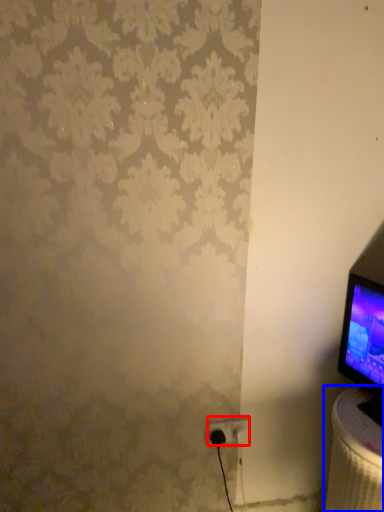
Question: Which point is further to the camera, power plugs and sockets (highlighted by a red box) or table (highlighted by a blue box)?

Choices:
 (A) power plugs and sockets
 (B) table

Answer: (A)